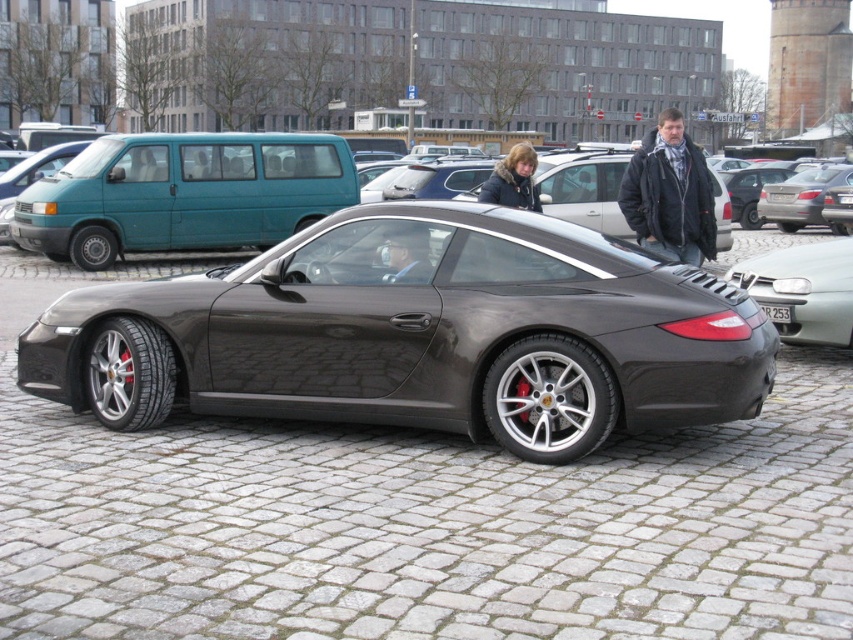
Question: Which of these objects is positioned farthest from the black plastic license plate at center?

Choices:
 (A) metallic gray car at center
 (B) shiny metallic car at center

Answer: (B)

Question: Which object appears closest to the camera in this image?

Choices:
 (A) dark gray leather jacket at upper right
 (B) shiny metallic car at center

Answer: (B)

Question: Which point is closer to the camera taking this photo?

Choices:
 (A) (785, 314)
 (B) (115, 426)

Answer: (B)

Question: Is metallic gray car at center further to camera compared to white plastic license plate at center?

Choices:
 (A) no
 (B) yes

Answer: (A)

Question: Is metallic gray car at center below dark brown leather jacket at upper center?

Choices:
 (A) no
 (B) yes

Answer: (B)

Question: Is metallic gray car at center thinner than black plastic license plate at center?

Choices:
 (A) yes
 (B) no

Answer: (B)